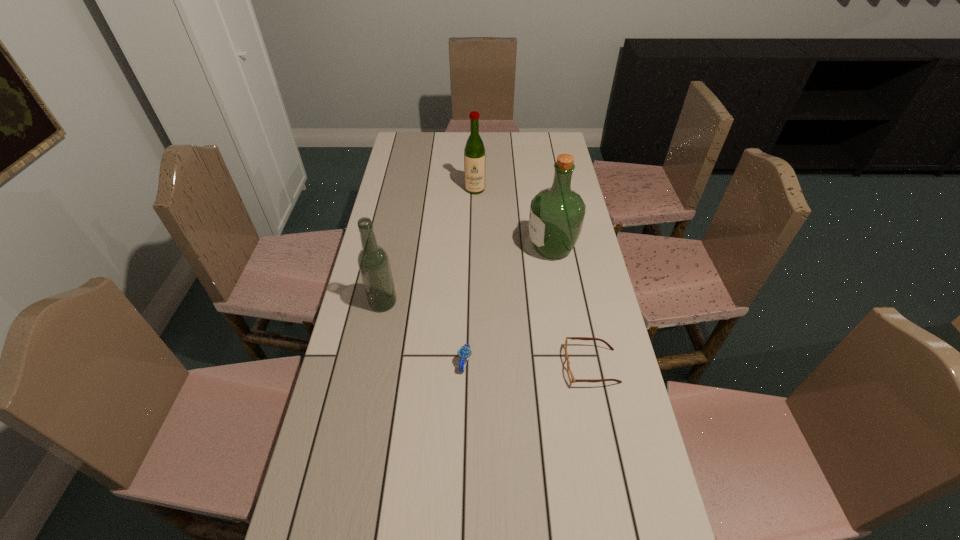
You are a GUI agent. You are given a task and a screenshot of the screen. Output one action in this format:
    pyautogui.click(x=<x>, y=<y>)
    Task: Click on the vacant region located 0.340m on the front-facing side of the rightmost liquor
    
    Given the screenshot: What is the action you would take?
    pyautogui.click(x=431, y=248)

This screenshot has width=960, height=540. In order to click on vacant space positioned 0.160m on the label of the farthest liquor in this screenshot , I will do `click(475, 220)`.

Identify the location of vacant space situated 0.370m on the front of the nearest liquor. This screenshot has width=960, height=540. (358, 427).

Locate an element on the screen. The width and height of the screenshot is (960, 540). vacant space situated on the back of the watch is located at coordinates (468, 280).

Where is `vacant space located on the front-facing side of the spectacles`? vacant space located on the front-facing side of the spectacles is located at coordinates (465, 366).

Identify the location of free spot located on the front-facing side of the spectacles. (511, 366).

The image size is (960, 540). I want to click on free location located 0.120m on the front-facing side of the spectacles, so click(521, 366).

Locate an element on the screen. This screenshot has height=540, width=960. object that is at the left edge is located at coordinates (373, 261).

The image size is (960, 540). What are the coordinates of `liquor that is at the right edge` in the screenshot? It's located at (556, 217).

The width and height of the screenshot is (960, 540). What are the coordinates of `spectacles present at the right edge` in the screenshot? It's located at (570, 374).